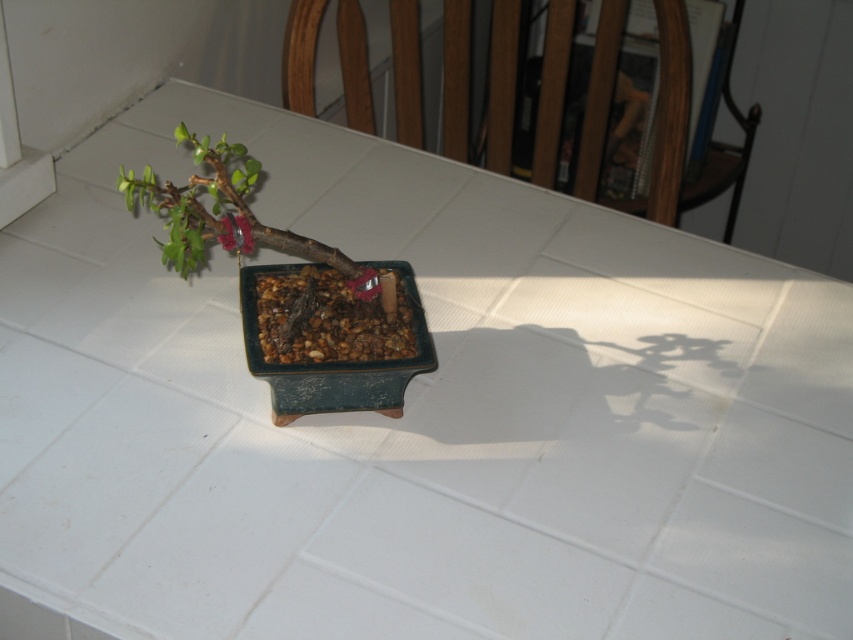
Is green matte bonsai at center wider than matte green flower at upper left?

Correct, the width of green matte bonsai at center exceeds that of matte green flower at upper left.

Does green matte bonsai at center have a greater height compared to matte green flower at upper left?

Yes, green matte bonsai at center is taller than matte green flower at upper left.

Find the location of `green matte bonsai at center`. green matte bonsai at center is located at coordinates (225, 212).